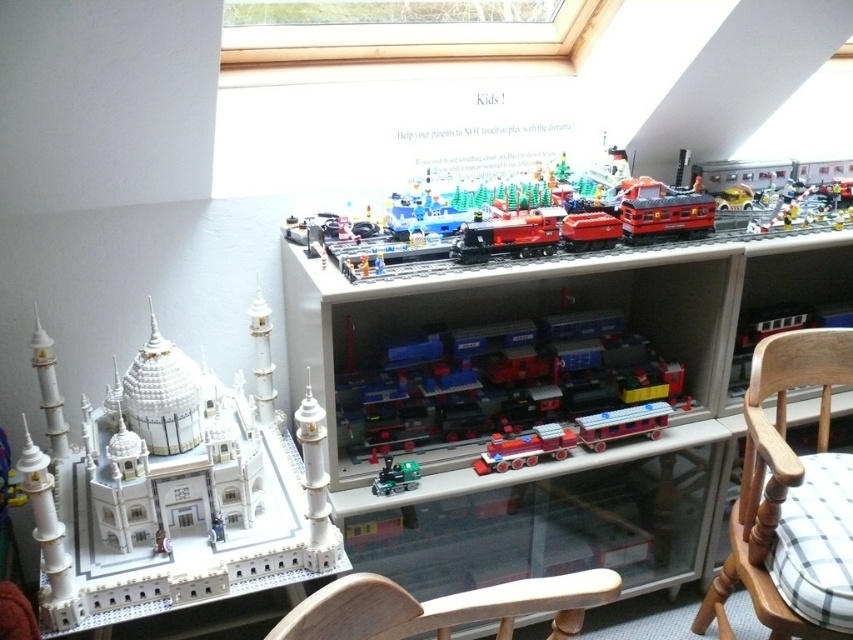
You are a visitor in the room and want to sit down. There is a wooden chair at lower center and a shiny red train at center. Which object is closer to the floor?

The wooden chair at lower center is below the shiny red train at center, so the wooden chair at lower center is closer to the floor.

You are standing in front of the display cabinet and want to reach both the point at location (587, 580) and the point at (576, 435). Which point will you touch first?

You will touch the point at (587, 580) first because it is closer to you than the point at (576, 435).